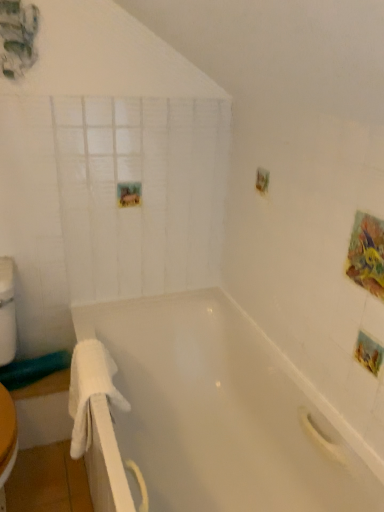
The height and width of the screenshot is (512, 384). Find the location of `white matte glass door at upper left`. white matte glass door at upper left is located at coordinates (141, 193).

What are the coordinates of `white fluffy towel at left` in the screenshot? It's located at (90, 390).

Identify the location of white glossy bathtub at center. This screenshot has height=512, width=384. (223, 411).

Identify the location of towel/napkin lying behind the white glossy bathtub at center. The width and height of the screenshot is (384, 512). (90, 390).

Between white fluffy towel at left and white glossy bathtub at center, which one appears on the right side from the viewer's perspective?

white glossy bathtub at center.

From the image's perspective, is white fluffy towel at left positioned above or below white glossy bathtub at center?

Based on their image positions, white fluffy towel at left is located above white glossy bathtub at center.

Which of these two, white glossy bathtub at center or white matte glass door at upper left, is bigger?

Bigger between the two is white glossy bathtub at center.

Is white glossy bathtub at center completely or partially outside of white matte glass door at upper left?

Yes, white glossy bathtub at center is outside of white matte glass door at upper left.

Where is `bathtub in front of the white matte glass door at upper left`? The height and width of the screenshot is (512, 384). bathtub in front of the white matte glass door at upper left is located at coordinates (223, 411).

Does white glossy bathtub at center appear on the right side of white matte glass door at upper left?

Yes.

Is point (160, 186) farther from camera compared to point (296, 391)?

Yes, point (160, 186) is farther from viewer.

Between white matte glass door at upper left and white glossy bathtub at center, which one has smaller size?

Smaller between the two is white matte glass door at upper left.

Is white matte glass door at upper left thinner than white glossy bathtub at center?

Yes, white matte glass door at upper left is thinner than white glossy bathtub at center.

Considering the relative positions of white glossy bathtub at center and white fluffy towel at left in the image provided, is white glossy bathtub at center to the left or to the right of white fluffy towel at left?

In the image, white glossy bathtub at center appears on the right side of white fluffy towel at left.

Who is taller, white glossy bathtub at center or white fluffy towel at left?

white glossy bathtub at center is taller.

Does white glossy bathtub at center have a greater width compared to white fluffy towel at left?

Yes, white glossy bathtub at center is wider than white fluffy towel at left.

From the image's perspective, which object appears higher, white glossy bathtub at center or white fluffy towel at left?

white fluffy towel at left is shown above in the image.

Is point (90, 415) less distant than point (141, 258)?

That is True.

From the image's perspective, which one is positioned higher, white fluffy towel at left or white matte glass door at upper left?

white matte glass door at upper left is shown above in the image.

From the picture: Is there a large distance between white fluffy towel at left and white matte glass door at upper left?

That's not correct — white fluffy towel at left is a little close to white matte glass door at upper left.

Considering the points (91, 260) and (91, 369), which point is in front, point (91, 260) or point (91, 369)?

Point (91, 369)

Considering the relative sizes of white matte glass door at upper left and white fluffy towel at left in the image provided, is white matte glass door at upper left shorter than white fluffy towel at left?

Incorrect, the height of white matte glass door at upper left does not fall short of that of white fluffy towel at left.

Where is `bathtub below the white fluffy towel at left (from a real-world perspective)`? This screenshot has height=512, width=384. bathtub below the white fluffy towel at left (from a real-world perspective) is located at coordinates (223, 411).

Where is `bathtub that appears below the white matte glass door at upper left (from the image's perspective)`? The height and width of the screenshot is (512, 384). bathtub that appears below the white matte glass door at upper left (from the image's perspective) is located at coordinates (223, 411).

When comparing their distances from white glossy bathtub at center, does white fluffy towel at left or white matte glass door at upper left seem further?

Among the two, white matte glass door at upper left is located further to white glossy bathtub at center.

Looking at the image, which one is located further to white glossy bathtub at center, white matte glass door at upper left or white fluffy towel at left?

white matte glass door at upper left is positioned further to the anchor white glossy bathtub at center.

Looking at the image, which one is located further to white matte glass door at upper left, white glossy bathtub at center or white fluffy towel at left?

white fluffy towel at left lies further to white matte glass door at upper left than the other object.

Looking at the image, which one is located closer to white fluffy towel at left, white glossy bathtub at center or white matte glass door at upper left?

white glossy bathtub at center is positioned closer to the anchor white fluffy towel at left.

Considering their positions, is white fluffy towel at left positioned further to white matte glass door at upper left than white glossy bathtub at center?

Among the two, white fluffy towel at left is located further to white matte glass door at upper left.

Which object lies nearer to the anchor point white fluffy towel at left, white matte glass door at upper left or white glossy bathtub at center?

white glossy bathtub at center is positioned closer to the anchor white fluffy towel at left.

You are a GUI agent. You are given a task and a screenshot of the screen. Output one action in this format:
    pyautogui.click(x=<x>, y=<y>)
    Task: Click on the towel/napkin between white matte glass door at upper left and white glossy bathtub at center in the up-down direction
    The image size is (384, 512).
    Given the screenshot: What is the action you would take?
    pyautogui.click(x=90, y=390)